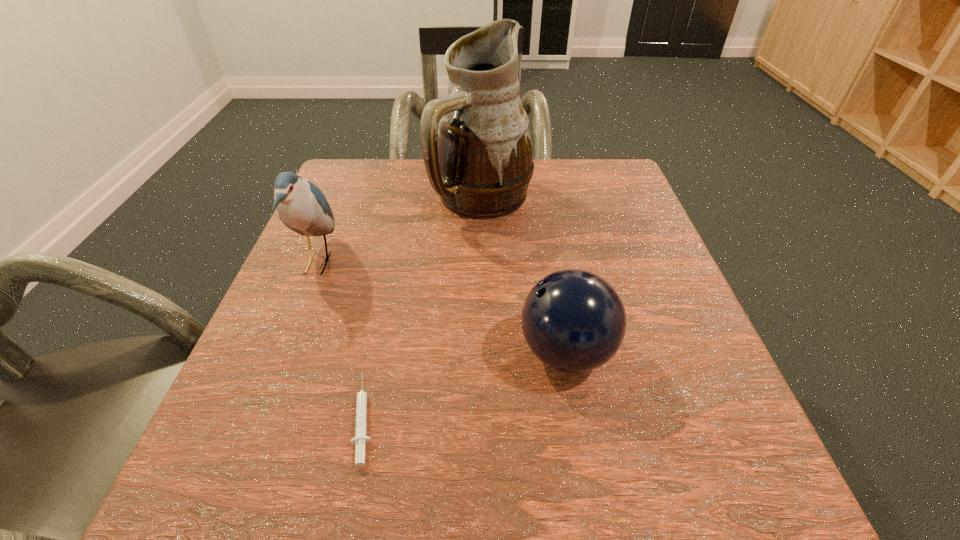
This screenshot has height=540, width=960. I want to click on free point at the right edge, so click(650, 349).

You are a GUI agent. You are given a task and a screenshot of the screen. Output one action in this format:
    pyautogui.click(x=<x>, y=<y>)
    Task: Click on the free space at the far left corner
    The image size is (960, 540).
    Given the screenshot: What is the action you would take?
    pyautogui.click(x=342, y=197)

Where is `vacant space at the near left corner of the desktop`? The height and width of the screenshot is (540, 960). vacant space at the near left corner of the desktop is located at coordinates (194, 504).

Image resolution: width=960 pixels, height=540 pixels. In the image, there is a desktop. Identify the location of vacant space at the far right corner. [609, 159].

This screenshot has height=540, width=960. What are the coordinates of `unoccupied area between the third tallest object and the bird` in the screenshot? It's located at (442, 307).

The width and height of the screenshot is (960, 540). I want to click on empty space between the third object from right to left and the tallest object, so click(x=423, y=308).

Image resolution: width=960 pixels, height=540 pixels. I want to click on free area in between the bowling ball and the shortest object, so click(x=466, y=385).

Locate an element on the screen. Image resolution: width=960 pixels, height=540 pixels. vacant area that lies between the leftmost object and the shortest object is located at coordinates pyautogui.click(x=341, y=340).

Locate an element on the screen. vacant region between the third nearest object and the bowling ball is located at coordinates (442, 307).

Identify the location of free space between the third shortest object and the bowling ball. Image resolution: width=960 pixels, height=540 pixels. (442, 307).